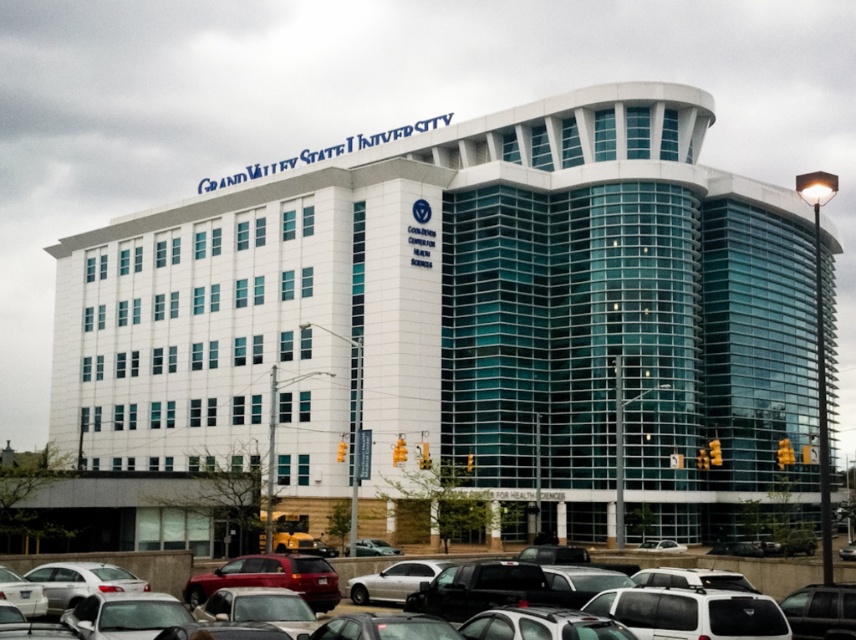
Question: Can you confirm if satin silver sedan at lower left is positioned to the left of metallic silver car at center?

Choices:
 (A) yes
 (B) no

Answer: (A)

Question: From the image, what is the correct spatial relationship of satin silver sedan at lower left in relation to white matte car at lower center?

Choices:
 (A) below
 (B) above

Answer: (B)

Question: Which point appears farthest from the camera in this image?

Choices:
 (A) (413, 554)
 (B) (366, 600)
 (C) (366, 541)
 (D) (396, 326)

Answer: (D)

Question: Does white glass building at center appear on the right side of metallic silver car at center?

Choices:
 (A) no
 (B) yes

Answer: (A)

Question: Which point is farther from the camera taking this photo?

Choices:
 (A) (629, 556)
 (B) (617, 224)
 (C) (272, 564)

Answer: (B)

Question: Which object is the farthest from the white glass building at center?

Choices:
 (A) white matte car at lower center
 (B) metallic gray cars at lower center
 (C) matte red suv at center
 (D) metallic silver car at center

Answer: (A)